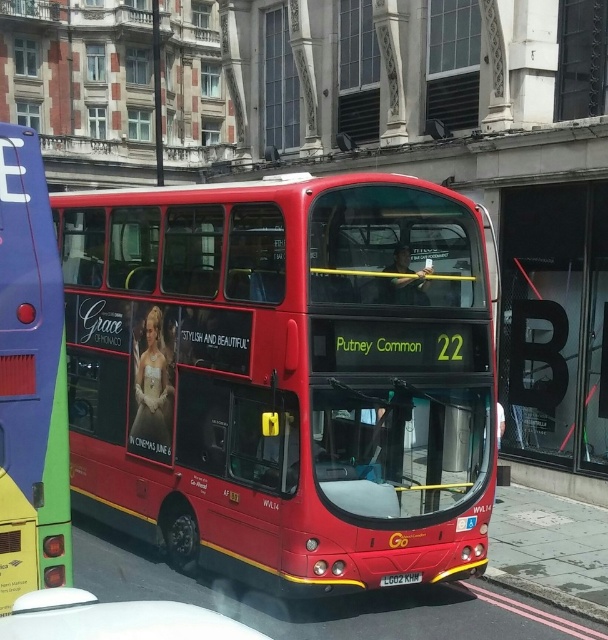
You are standing at the intersection and see the shiny red bus at center. If you want to cross the street to reach the bus stop located at the opposite corner, which direction should you look for the crosswalk?

The crosswalk should be located near the shiny red bus at center, but since the bus is at the center of the intersection, you should look for the crosswalk in the direction opposite to where the bus is parked.

You are standing in the middle of the road looking at the red double decker bus. There are two points marked on the bus, one at coordinate point (437, 266) and another at point (4, 240). Which point is closer to you?

Point (437, 266) is further to the viewer than point (4, 240), so the point closer to you is point (4, 240).

You are standing in the middle of the street looking at the red double decker bus. There are two points marked on the bus, one at coordinate point [12,515] and another at point [416,576]. Which point is closer to you?

Point [12,515] is closer to the viewer than point [416,576].